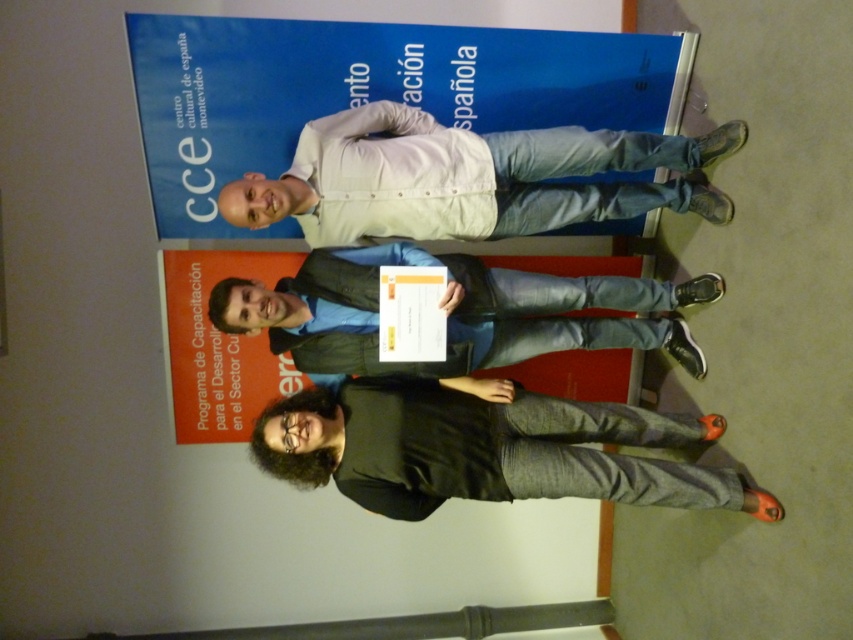
Question: Which of the following is the closest to the observer?

Choices:
 (A) (683, 284)
 (B) (544, 211)
 (C) (210, 29)
 (D) (473, 451)

Answer: (D)

Question: Where is white matte shirt at center located in relation to matte black shirt at center in the image?

Choices:
 (A) above
 (B) below

Answer: (A)

Question: Which object is closer to the camera taking this photo?

Choices:
 (A) white matte shirt at center
 (B) dark gray cotton pants at lower center
 (C) blue paper at upper center

Answer: (B)

Question: Which is nearer to the matte black shirt at center?

Choices:
 (A) blue paper at upper center
 (B) white matte shirt at center

Answer: (B)

Question: Does blue paper at upper center have a smaller size compared to matte black shirt at center?

Choices:
 (A) yes
 (B) no

Answer: (B)

Question: Can you confirm if white matte shirt at center is smaller than matte black shirt at center?

Choices:
 (A) yes
 (B) no

Answer: (A)